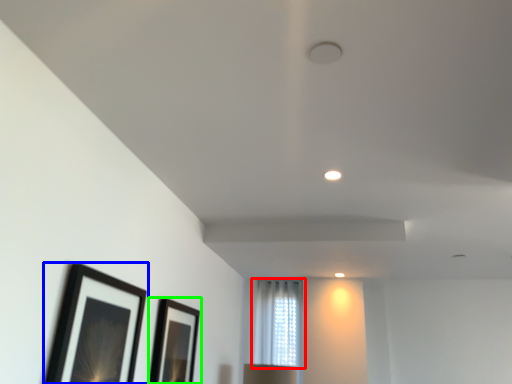
Question: Considering the real-world distances, which object is farthest from window (highlighted by a red box)? picture frame (highlighted by a blue box) or picture frame (highlighted by a green box)?

Choices:
 (A) picture frame
 (B) picture frame

Answer: (A)